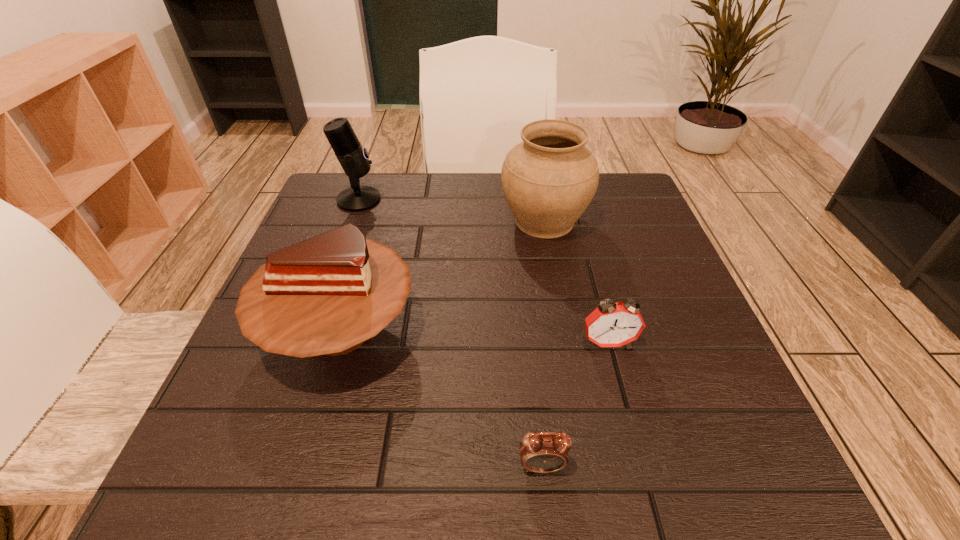
The image size is (960, 540). In order to click on free area in between the microphone and the urn in this screenshot , I will do `click(451, 210)`.

I want to click on empty space that is in between the microphone and the urn, so click(451, 210).

Where is `vacant space that is in between the taller alarm clock and the microphone`? This screenshot has height=540, width=960. vacant space that is in between the taller alarm clock and the microphone is located at coordinates (483, 271).

This screenshot has height=540, width=960. What are the coordinates of `vacant point located between the cake and the urn` in the screenshot? It's located at (442, 275).

Where is `object that stands as the second closest to the taller alarm clock`? The width and height of the screenshot is (960, 540). object that stands as the second closest to the taller alarm clock is located at coordinates (549, 179).

Select which object is the closest to the microphone. Please provide its 2D coordinates. Your answer should be formatted as a tuple, i.e. [(x, y)], where the tuple contains the x and y coordinates of a point satisfying the conditions above.

[(326, 295)]